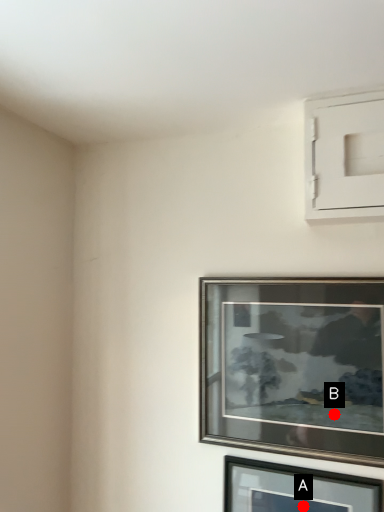
Question: Two points are circled on the image, labeled by A and B beside each circle. Which of the following is the closest to the observer?

Choices:
 (A) A is closer
 (B) B is closer

Answer: (B)